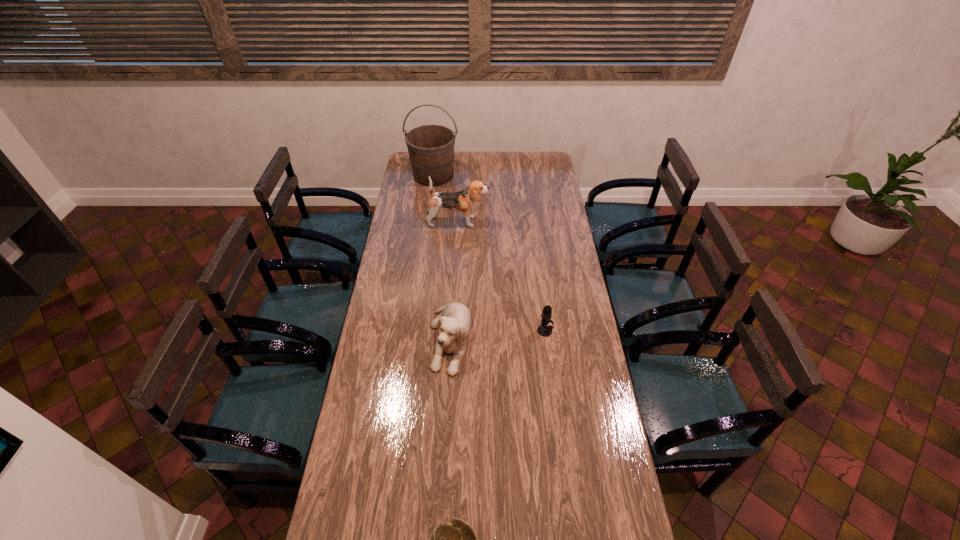
Where is `vacant space situated 0.160m on the front-facing side of the shorter puppy`? This screenshot has height=540, width=960. vacant space situated 0.160m on the front-facing side of the shorter puppy is located at coordinates (445, 418).

Identify the location of free space located on the left of the second shortest object. (458, 331).

Find the location of a particular element. object at the far edge is located at coordinates (431, 147).

The height and width of the screenshot is (540, 960). I want to click on object situated at the left edge, so click(x=431, y=147).

Locate an element on the screen. The height and width of the screenshot is (540, 960). object that is at the right edge is located at coordinates (544, 330).

Identify the location of object present at the far left corner. (431, 147).

Where is `vacant area at the far edge`? The height and width of the screenshot is (540, 960). vacant area at the far edge is located at coordinates (499, 153).

In the image, there is a desktop. Identify the location of vacant space at the left edge. The image size is (960, 540). (403, 200).

Identify the location of vacant space at the right edge. The height and width of the screenshot is (540, 960). (535, 208).

Identify the location of vacant space at the far right corner of the desktop. The width and height of the screenshot is (960, 540). (535, 167).